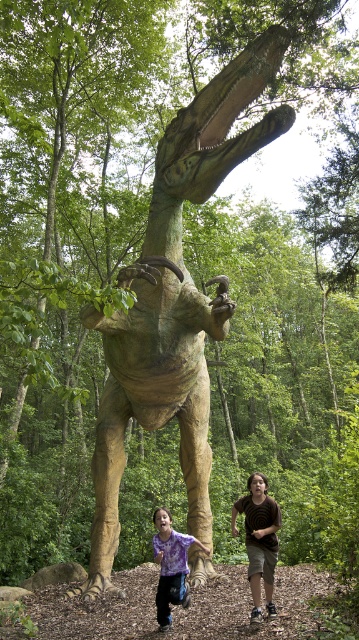
You are a photographer trying to capture a photo of the green textured dinosaur at center. To ensure the dinosaur is the main focus, you need to position yourself so that it is centered in your viewfinder. Given its coordinates at point 0.472, 0.487, where should you aim your camera?

The green textured dinosaur at center is located at point (174,301), so you should aim your camera directly at those coordinates to center it in your viewfinder.

You are standing in the forest and see the green textured dinosaur at center. If you want to take a photo of it, where should you position yourself to ensure it is in the center of your camera frame?

You should position yourself directly in front of the green textured dinosaur at center, as it is already located at the center of the image at point coordinates (174, 301).